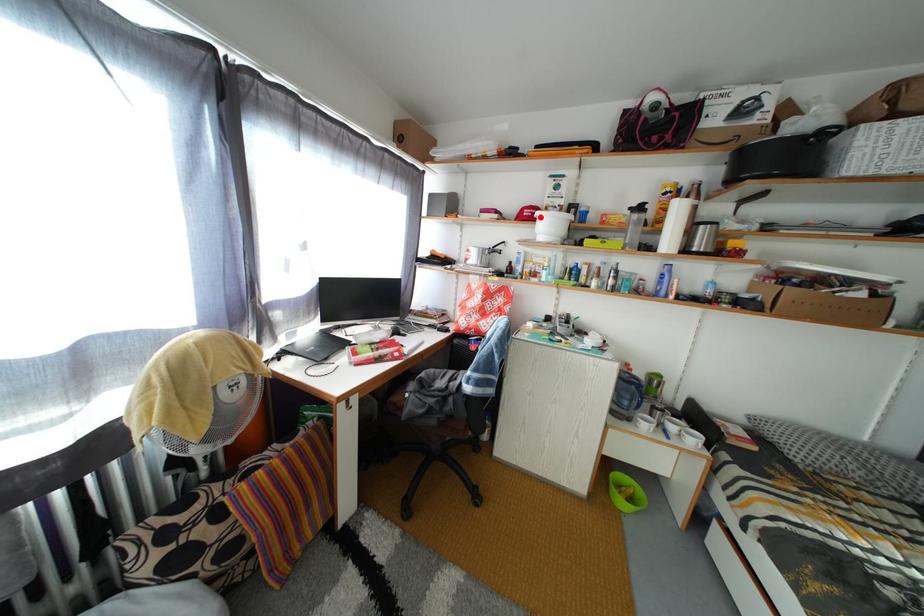
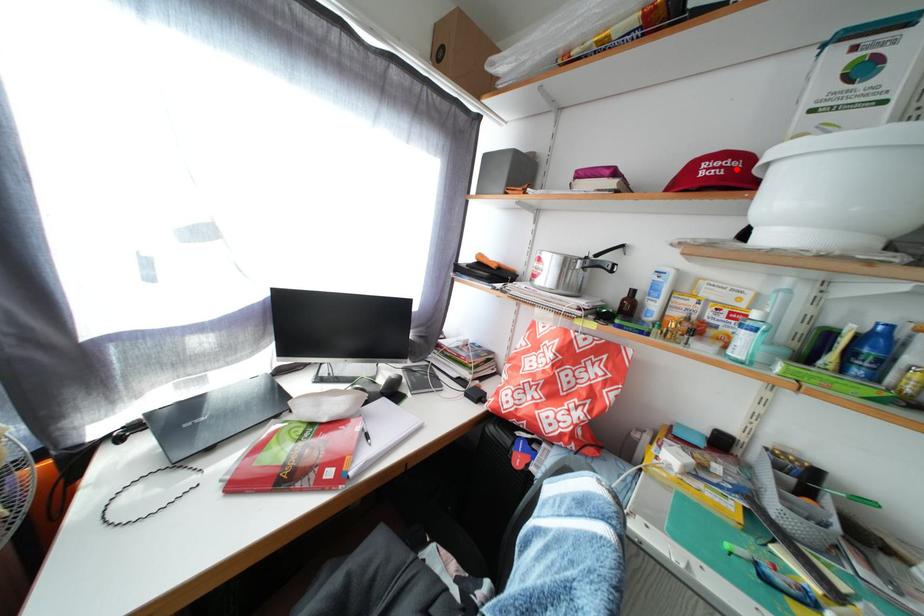
I am providing you with two images of the same scene from different viewpoints. A red point is marked on the first image and another point is marked on the second image. Do the highlighted points in image1 and image2 indicate the same real-world spot?

Yes